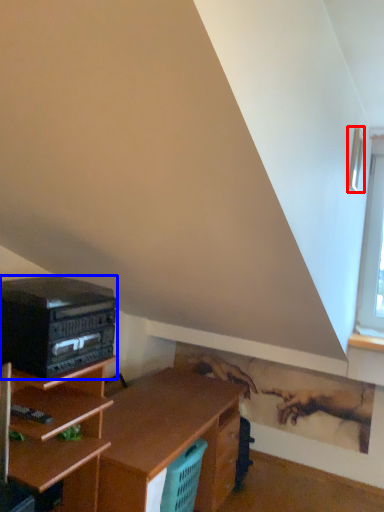
Question: Among these objects, which one is nearest to the camera, window (highlighted by a red box) or stereo (highlighted by a blue box)?

Choices:
 (A) window
 (B) stereo

Answer: (B)